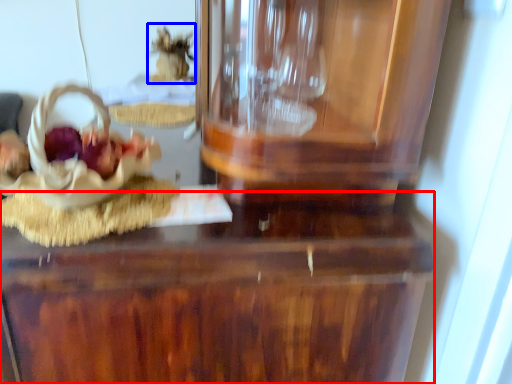
Question: Which object is further to the camera taking this photo, table (highlighted by a red box) or stuff (highlighted by a blue box)?

Choices:
 (A) table
 (B) stuff

Answer: (B)